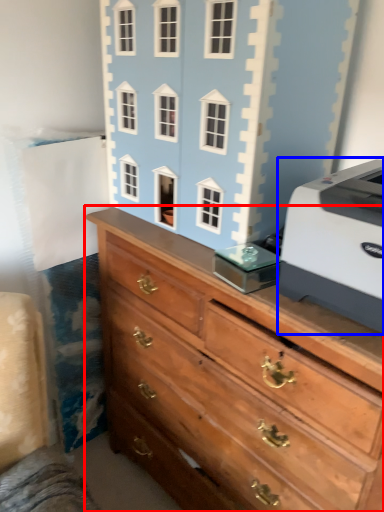
Question: Which object appears farthest to the camera in this image, chest of drawers (highlighted by a red box) or printer (highlighted by a blue box)?

Choices:
 (A) chest of drawers
 (B) printer

Answer: (B)